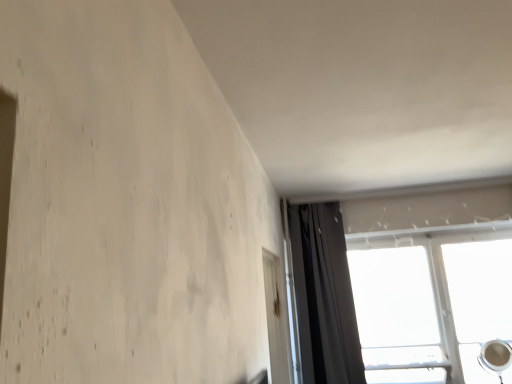
Question: Is transparent glass window at upper right positioned far away from dark gray fabric curtain at upper right?

Choices:
 (A) no
 (B) yes

Answer: (A)

Question: Can you confirm if transparent glass window at upper right is positioned to the right of dark gray fabric curtain at upper right?

Choices:
 (A) no
 (B) yes

Answer: (B)

Question: Does transparent glass window at upper right have a smaller size compared to dark gray fabric curtain at upper right?

Choices:
 (A) no
 (B) yes

Answer: (A)

Question: From a real-world perspective, is transparent glass window at upper right positioned over dark gray fabric curtain at upper right based on gravity?

Choices:
 (A) yes
 (B) no

Answer: (B)

Question: Does transparent glass window at upper right have a greater height compared to dark gray fabric curtain at upper right?

Choices:
 (A) no
 (B) yes

Answer: (A)

Question: Does transparent glass window at upper right have a larger size compared to dark gray fabric curtain at upper right?

Choices:
 (A) no
 (B) yes

Answer: (B)

Question: Is transparent plastic screen door at lower right at the back of dark gray fabric curtain at upper right?

Choices:
 (A) no
 (B) yes

Answer: (A)

Question: From a real-world perspective, is dark gray fabric curtain at upper right under transparent plastic screen door at lower right?

Choices:
 (A) no
 (B) yes

Answer: (A)

Question: Is dark gray fabric curtain at upper right aimed at transparent plastic screen door at lower right?

Choices:
 (A) no
 (B) yes

Answer: (A)

Question: Considering the relative sizes of dark gray fabric curtain at upper right and transparent plastic screen door at lower right in the image provided, is dark gray fabric curtain at upper right shorter than transparent plastic screen door at lower right?

Choices:
 (A) no
 (B) yes

Answer: (A)

Question: Considering the relative sizes of dark gray fabric curtain at upper right and transparent plastic screen door at lower right in the image provided, is dark gray fabric curtain at upper right bigger than transparent plastic screen door at lower right?

Choices:
 (A) no
 (B) yes

Answer: (B)

Question: From the image's perspective, is dark gray fabric curtain at upper right on top of transparent plastic screen door at lower right?

Choices:
 (A) yes
 (B) no

Answer: (A)

Question: From the image's perspective, is transparent plastic screen door at lower right below dark gray fabric curtain at upper right?

Choices:
 (A) no
 (B) yes

Answer: (B)